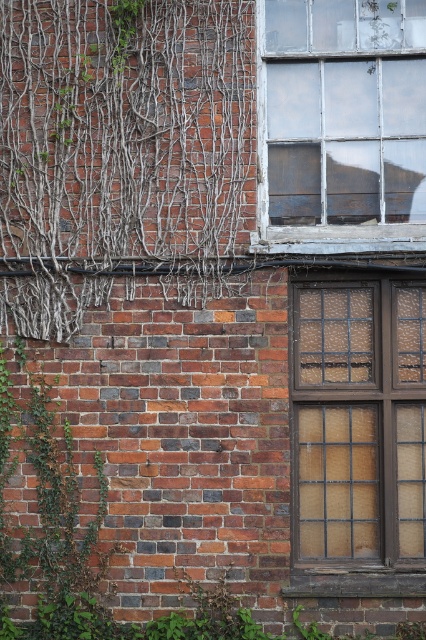
Who is positioned more to the right, brown wooden window at center or white painted wood window frame at upper right?

brown wooden window at center

This screenshot has height=640, width=426. Identify the location of brown wooden window at center. (357, 435).

Find the location of a particular element. brown wooden window at center is located at coordinates (357, 435).